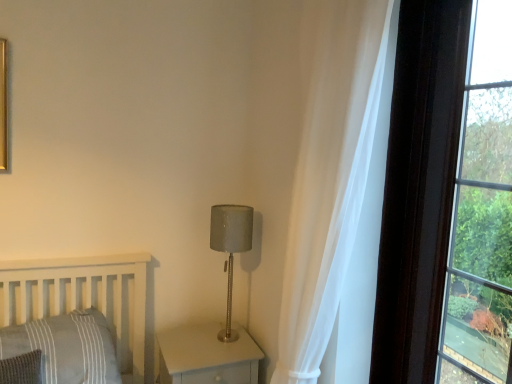
Question: Considering the relative positions of white sheer curtain at right and gray striped pillow at lower left in the image provided, is white sheer curtain at right to the left of gray striped pillow at lower left from the viewer's perspective?

Choices:
 (A) yes
 (B) no

Answer: (B)

Question: Is white sheer curtain at right not near gray striped pillow at lower left?

Choices:
 (A) no
 (B) yes

Answer: (B)

Question: Considering the relative sizes of white sheer curtain at right and gray striped pillow at lower left in the image provided, is white sheer curtain at right smaller than gray striped pillow at lower left?

Choices:
 (A) yes
 (B) no

Answer: (B)

Question: Is white sheer curtain at right further to the viewer compared to gray striped pillow at lower left?

Choices:
 (A) yes
 (B) no

Answer: (B)

Question: Is white sheer curtain at right oriented towards gray striped pillow at lower left?

Choices:
 (A) no
 (B) yes

Answer: (A)

Question: From a real-world perspective, relative to satin gray lampshade at center, is gray striped pillow at lower left vertically above or below?

Choices:
 (A) below
 (B) above

Answer: (A)

Question: Visually, is gray striped pillow at lower left positioned to the left or to the right of satin gray lampshade at center?

Choices:
 (A) left
 (B) right

Answer: (A)

Question: In terms of height, does gray striped pillow at lower left look taller or shorter compared to satin gray lampshade at center?

Choices:
 (A) short
 (B) tall

Answer: (A)

Question: In terms of width, does gray striped pillow at lower left look wider or thinner when compared to satin gray lampshade at center?

Choices:
 (A) wide
 (B) thin

Answer: (A)

Question: Would you say matte gray wood nightstand at lower center is to the left or to the right of satin gray lampshade at center in the picture?

Choices:
 (A) left
 (B) right

Answer: (A)

Question: Is matte gray wood nightstand at lower center taller or shorter than satin gray lampshade at center?

Choices:
 (A) short
 (B) tall

Answer: (A)

Question: Is point (188, 332) positioned closer to the camera than point (224, 216)?

Choices:
 (A) farther
 (B) closer

Answer: (A)

Question: Is matte gray wood nightstand at lower center inside or outside of satin gray lampshade at center?

Choices:
 (A) inside
 (B) outside

Answer: (B)

Question: Which is correct: matte gray wood nightstand at lower center is inside gray striped pillow at lower left, or outside of it?

Choices:
 (A) outside
 (B) inside

Answer: (A)

Question: From a real-world perspective, relative to gray striped pillow at lower left, is matte gray wood nightstand at lower center vertically above or below?

Choices:
 (A) above
 (B) below

Answer: (B)